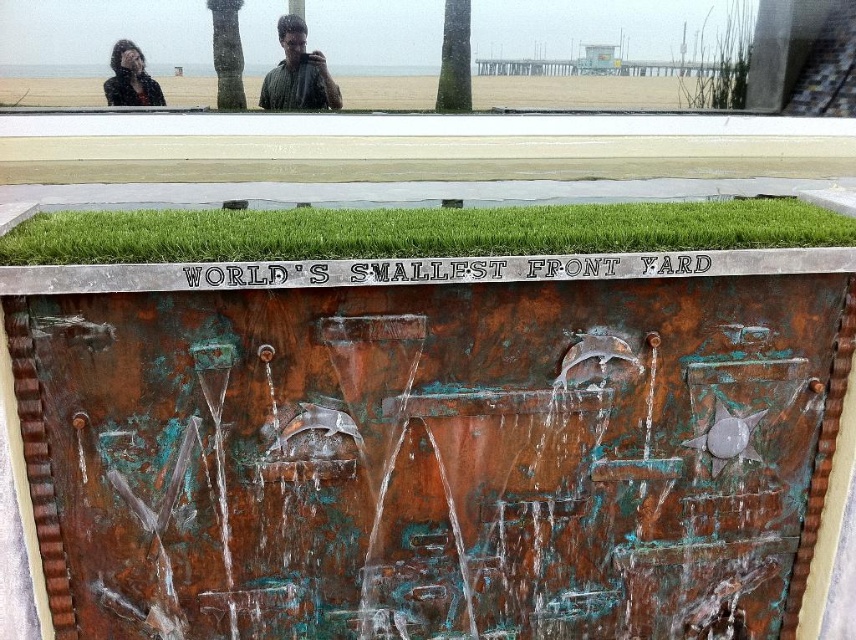
Is rusty copper water at center positioned at the back of green patina metal palm tree at center?

No, it is not.

Is point (688, 444) positioned behind point (455, 20)?

No, it is in front of (455, 20).

Where is `rusty copper water at center`? This screenshot has height=640, width=856. rusty copper water at center is located at coordinates (432, 456).

Can you confirm if green grass at upper center is bigger than dark brown hair at upper left?

Correct, green grass at upper center is larger in size than dark brown hair at upper left.

Does green grass at upper center appear under dark brown hair at upper left?

Correct, green grass at upper center is located below dark brown hair at upper left.

The height and width of the screenshot is (640, 856). I want to click on green grass at upper center, so click(581, 92).

Does green patina metal palm tree at center lie in front of dark brown hair at upper left?

No, green patina metal palm tree at center is behind dark brown hair at upper left.

Can you confirm if green patina metal palm tree at center is bigger than dark brown hair at upper left?

Indeed, green patina metal palm tree at center has a larger size compared to dark brown hair at upper left.

Which is behind, point (459, 40) or point (158, 99)?

The point (459, 40) is more distant.

Where is `green patina metal palm tree at center`? The image size is (856, 640). green patina metal palm tree at center is located at coordinates (455, 58).